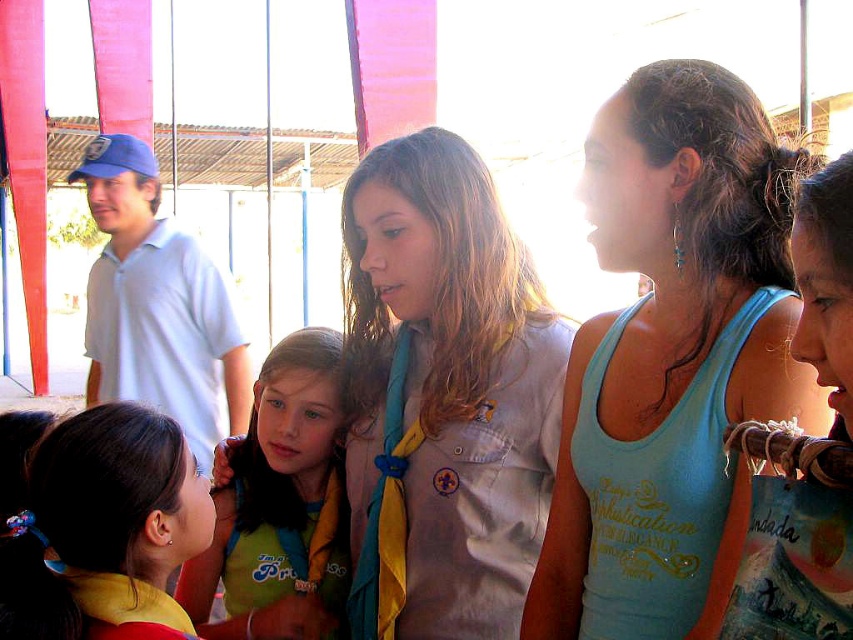
Question: Among these points, which one is farthest from the camera?

Choices:
 (A) (35, 632)
 (B) (277, 572)
 (C) (706, 76)
 (D) (524, 342)

Answer: (B)

Question: Which point is closer to the camera?

Choices:
 (A) (45, 579)
 (B) (308, 611)

Answer: (A)

Question: Does light brown fabric uniform at center appear on the left side of green jersey at center?

Choices:
 (A) no
 (B) yes

Answer: (A)

Question: Observing the image, what is the correct spatial positioning of blue tank top at center in reference to green jersey at center?

Choices:
 (A) left
 (B) right

Answer: (B)

Question: Which object appears farthest from the camera in this image?

Choices:
 (A) green jersey at center
 (B) yellow fabric hairband at lower left
 (C) blue tank top at center

Answer: (A)

Question: Is blue tank top at center wider than green jersey at center?

Choices:
 (A) yes
 (B) no

Answer: (B)